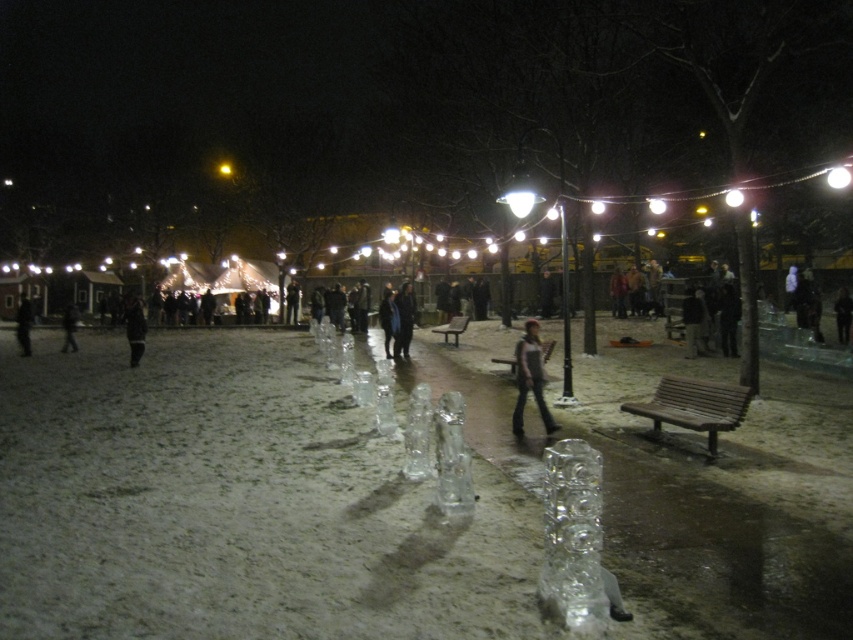
You are a photographer setting up a tripod in the snow between the dark gray jeans at center and the black matte jacket at center. The tripod requires a minimum space of 1 meter between objects to set up. Can you set up the tripod here?

The dark gray jeans at center is narrower than the black matte jacket at center, but the description only mentions their widths and does not provide specific measurements or distances between them. Without knowing the actual distance between the two objects, it is impossible to determine if the tripod can be set up here.

You are standing in the snow at the park and want to take a photo of the ice sculptures. The camera you are using has a zoom lens that can focus on objects up to 2 meters away. If you are standing at point (518, 381), can you focus on the ice sculptures located at point (125, 305)?

Point (518, 381) is closer to the camera than point (125, 305). Since the camera can focus up to 2 meters, you need to know the distance between these points. However, the description only states their relative positions. Without exact distances, we can infer that if the farther point is within 2 meters, it would work. But since we don

You are standing in the snowy park and want to take a photo of the dark gray jeans at center and the black matte jacket at center together in the frame. Which object should you position closer to the left side of your camera to include both in the photo?

You should position the black matte jacket at center closer to the left side of your camera because the dark gray jeans at center is to the right of it, ensuring both appear in the frame.